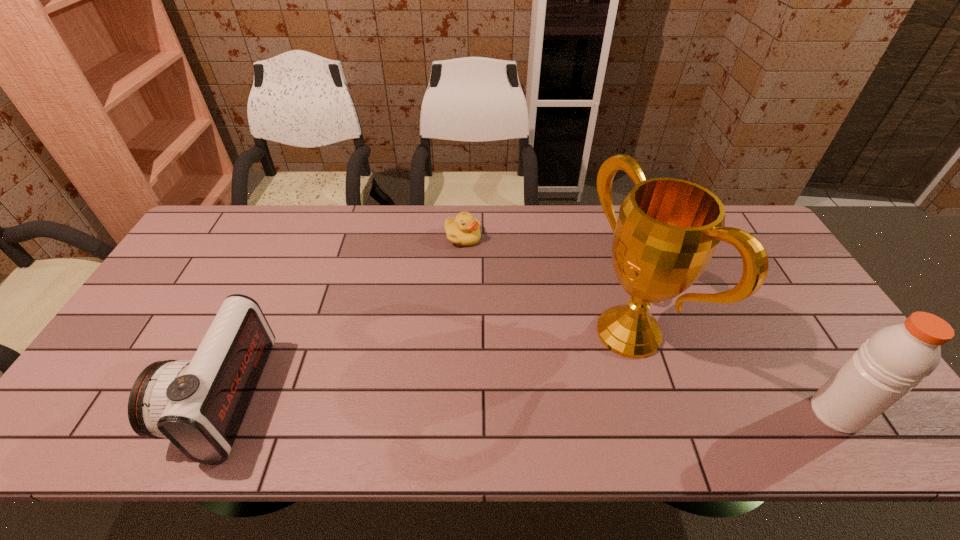
Find the location of a particular element. The width and height of the screenshot is (960, 540). blank region between the award and the camcorder is located at coordinates (426, 365).

What are the coordinates of `blank region between the duckling and the award` in the screenshot? It's located at (545, 285).

Locate an element on the screen. The height and width of the screenshot is (540, 960). vacant area that lies between the shaker and the tallest object is located at coordinates (732, 373).

Locate an element on the screen. The image size is (960, 540). empty space between the farthest object and the camcorder is located at coordinates (344, 318).

The width and height of the screenshot is (960, 540). I want to click on vacant region between the third tallest object and the shaker, so click(x=530, y=406).

Identify which object is the second closest to the shortest object. Please provide its 2D coordinates. Your answer should be formatted as a tuple, i.e. [(x, y)], where the tuple contains the x and y coordinates of a point satisfying the conditions above.

[(199, 405)]

Identify which object is located as the nearest to the shaker. Please provide its 2D coordinates. Your answer should be formatted as a tuple, i.e. [(x, y)], where the tuple contains the x and y coordinates of a point satisfying the conditions above.

[(667, 231)]

At what (x,y) coordinates should I click in order to perform the action: click on vacant area that satisfies the following two spatial constraints: 1. on the front side of the rightmost object; 2. on the right side of the duckling. Please return your answer as a coordinate pair (x, y). The height and width of the screenshot is (540, 960). Looking at the image, I should click on (455, 413).

Identify the location of blank area in the image that satisfies the following two spatial constraints: 1. on the front side of the award; 2. on the left side of the farthest object. (459, 332).

Image resolution: width=960 pixels, height=540 pixels. I want to click on free space that satisfies the following two spatial constraints: 1. on the front side of the second tallest object; 2. on the right side of the duckling, so click(x=455, y=413).